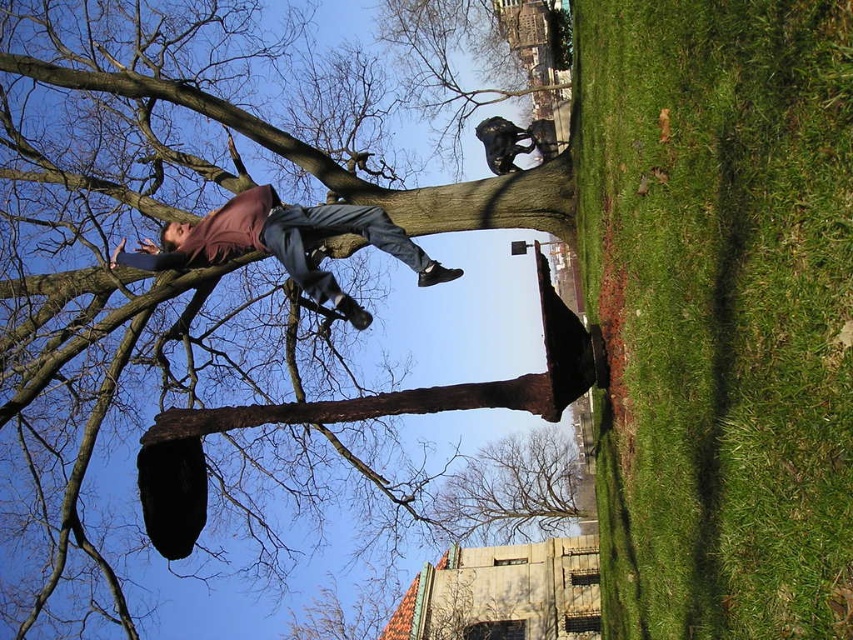
You are a park ranger assessing safety distances in the park. According to park regulations, any tree trunk must be at least 20 meters away from any person to prevent accidents. Is the brown rough tree trunk at upper center compliant with this regulation regarding the matte brown pants at upper center?

The brown rough tree trunk at upper center is 19.57 meters from matte brown pants at upper center, which is less than the required 20 meters. Therefore, it does not comply with the park regulations.

You are standing at the center of the park and want to locate the brown rough tree trunk at upper center. According to the coordinates provided, in which direction should you move to face it?

The brown rough tree trunk at upper center is located at coordinates point (207, 291). Since the y coordinate is 0.244, which is closer to the bottom of the image, you should look upward to face it.

You are a drone operator trying to capture a photo of the brown rough tree trunk at upper center. Your drone can only fly up to 70 meters. Based on the scene, can your drone reach the tree trunk?

The distance between the brown rough tree trunk at upper center and the camera is 72.37 meters, which exceeds the drone operator can fly up to 70 meters. Therefore, the drone cannot reach the tree trunk.